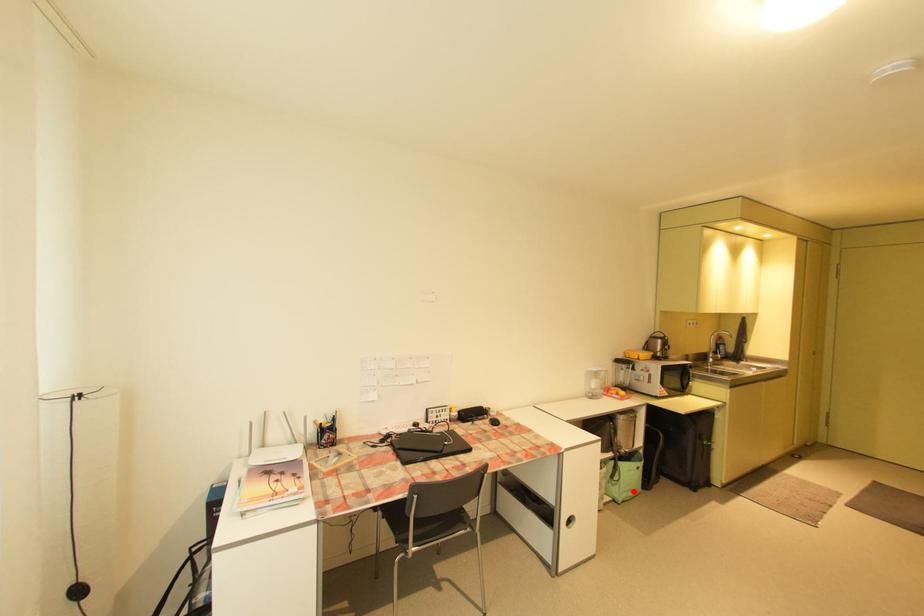
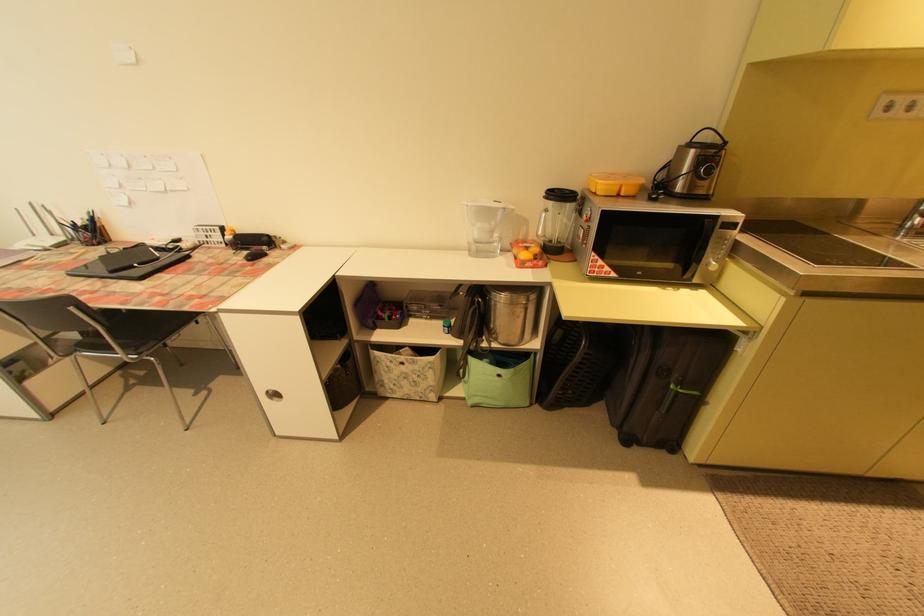
Question: I am providing you with two images of the same scene from different viewpoints. Image1 has a red point marked. In image2, the corresponding 3D location appears at what relative position? Reply with the corresponding letter.

Choices:
 (A) Closer
 (B) Farther

Answer: (A)